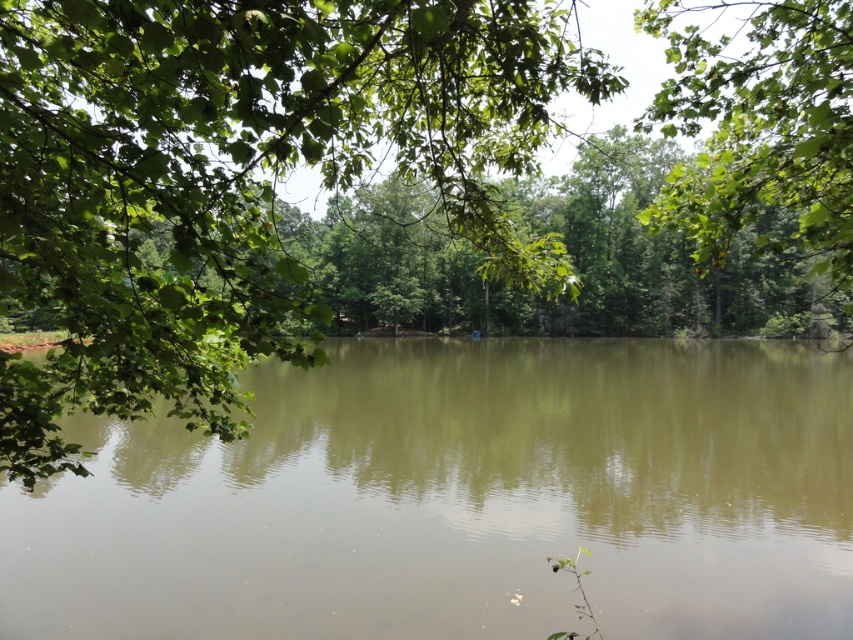
Is green leafy tree at center above green leafy tree at upper right?

Incorrect, green leafy tree at center is not positioned above green leafy tree at upper right.

Which is more to the right, green leafy tree at center or green leafy tree at upper right?

Positioned to the right is green leafy tree at upper right.

Find the location of a particular element. This screenshot has width=853, height=640. green leafy tree at center is located at coordinates point(236,179).

Locate an element on the screen. This screenshot has height=640, width=853. green leafy tree at center is located at coordinates click(236, 179).

Can you confirm if greenish-brown water at center is positioned to the left of green leafy tree at upper right?

Yes, greenish-brown water at center is to the left of green leafy tree at upper right.

Is greenish-brown water at center wider than green leafy tree at upper right?

In fact, greenish-brown water at center might be narrower than green leafy tree at upper right.

Which is in front, point (851, 573) or point (654, 99)?

Point (851, 573)

At what (x,y) coordinates should I click in order to perform the action: click on greenish-brown water at center. Please return your answer as a coordinate pair (x, y). The width and height of the screenshot is (853, 640). Looking at the image, I should click on tap(461, 499).

Between greenish-brown water at center and green leafy tree at center, which one is positioned lower?

greenish-brown water at center

Does greenish-brown water at center appear on the left side of green leafy tree at center?

No, greenish-brown water at center is not to the left of green leafy tree at center.

Describe the element at coordinates (461, 499) in the screenshot. I see `greenish-brown water at center` at that location.

Find the location of a particular element. The image size is (853, 640). greenish-brown water at center is located at coordinates (461, 499).